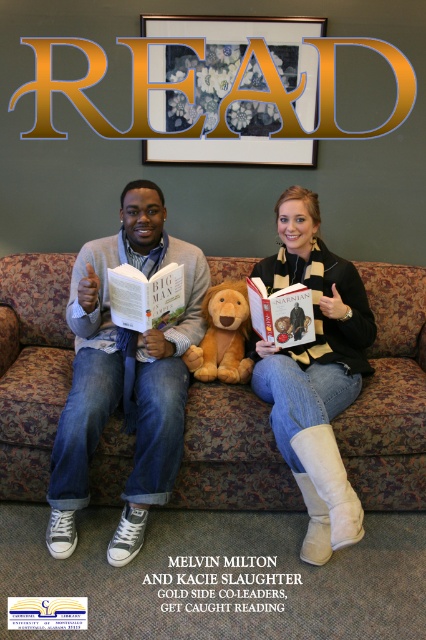
Is white suede boots at lower right positioned before brown plush teddy bear at center?

Yes, white suede boots at lower right is closer to the viewer.

Who is higher up, white suede boots at lower right or brown plush teddy bear at center?

brown plush teddy bear at center

Is point (313, 371) in front of point (210, 304)?

Yes, point (313, 371) is closer to viewer.

Find the location of `white suede boots at lower right`. white suede boots at lower right is located at coordinates (316, 372).

Between point (244, 358) and point (146, 310), which one is positioned in front?

Positioned in front is point (146, 310).

Between point (201, 360) and point (155, 316), which one is positioned behind?

Positioned behind is point (201, 360).

I want to click on brown plush teddy bear at center, so click(x=222, y=336).

Find the location of a particular element. The image size is (426, 640). brown plush teddy bear at center is located at coordinates (222, 336).

Can you confirm if matte gray sweater at center is taller than white suede boots at lower right?

Indeed, matte gray sweater at center has a greater height compared to white suede boots at lower right.

The width and height of the screenshot is (426, 640). What do you see at coordinates (124, 376) in the screenshot?
I see `matte gray sweater at center` at bounding box center [124, 376].

Where is `matte gray sweater at center`? matte gray sweater at center is located at coordinates (124, 376).